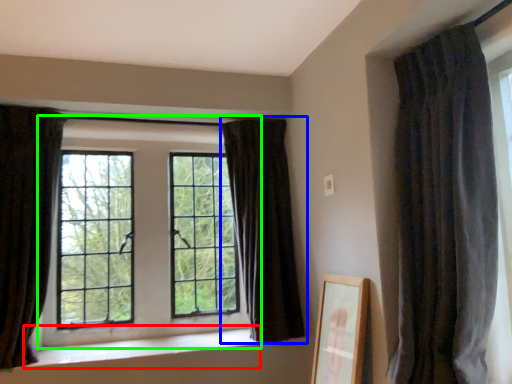
Question: Which object is the farthest from window sill (highlighted by a red box)? Choose among these: curtain (highlighted by a blue box) or window (highlighted by a green box).

Choices:
 (A) curtain
 (B) window

Answer: (A)